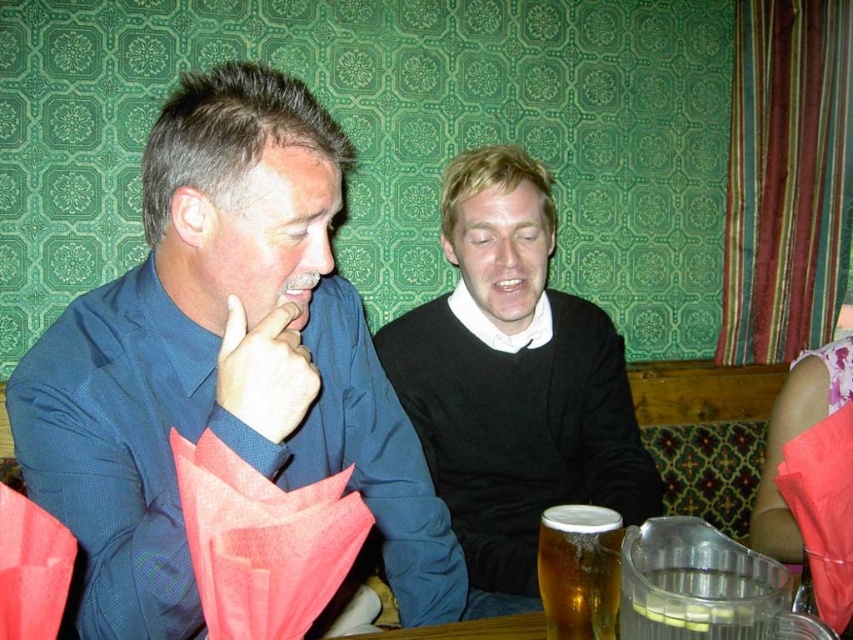
You are a waiter in a pub. You see the matte blue shirt at left and the golden amber liquid at lower center. Which object is closer to the ceiling?

The matte blue shirt at left is above the golden amber liquid at lower center, so it is closer to the ceiling.

Consider the image. You are a waiter in a restaurant and need to place a new drink order for the customer wearing the black matte sweater at center. Where should you place the drink relative to the golden amber liquid at lower center?

The black matte sweater at center is to the left of the golden amber liquid at lower center, so you should place the new drink to the right of the golden amber liquid at lower center to keep it near the customer.